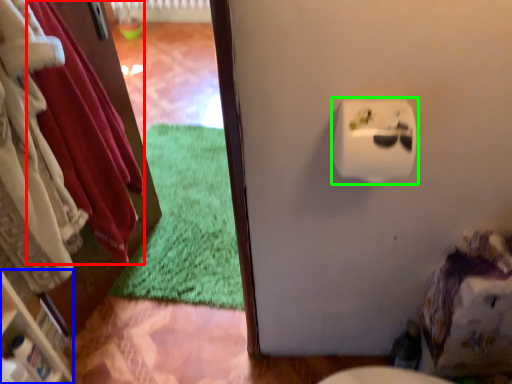
Question: Which object is positioned farthest from clothing (highlighted by a red box)? Select from shelf (highlighted by a blue box) and toilet paper (highlighted by a green box).

Choices:
 (A) shelf
 (B) toilet paper

Answer: (B)